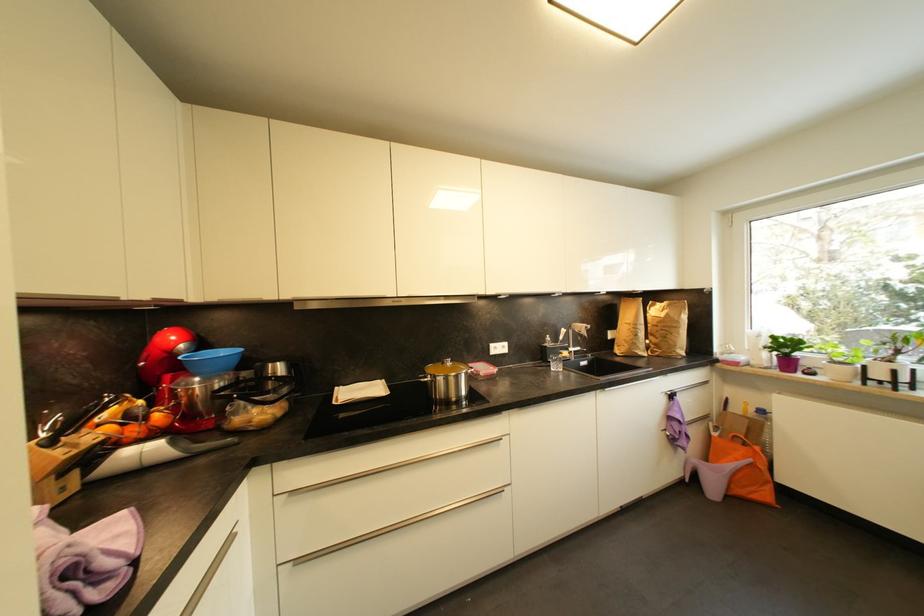
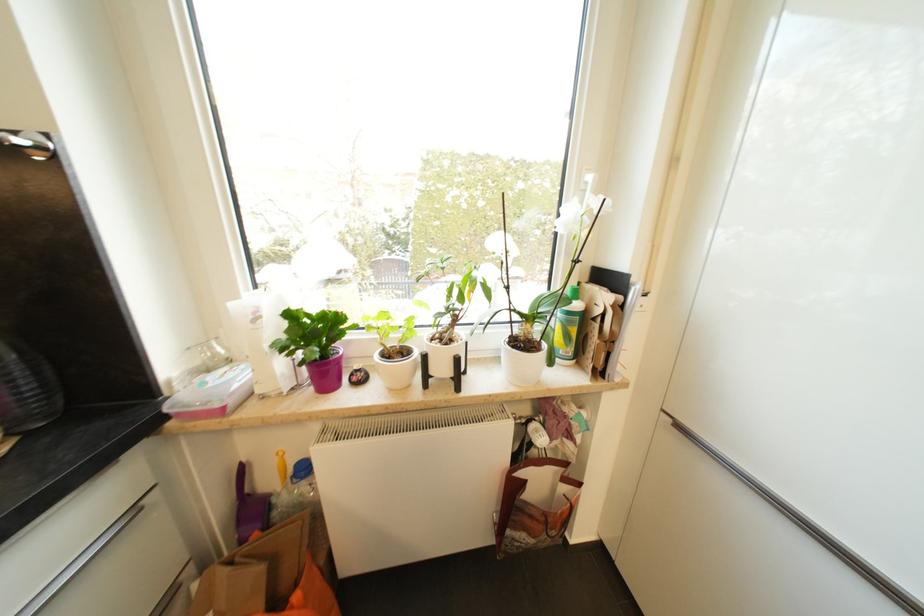
Locate, in the second image, the point that corresponds to (883,377) in the first image.

(446, 371)